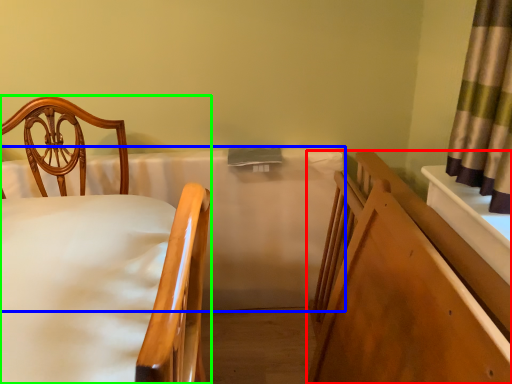
Question: Which object is positioned farthest from bed frame (highlighted by a red box)? Select from mattress (highlighted by a blue box) and chair (highlighted by a green box).

Choices:
 (A) mattress
 (B) chair

Answer: (B)